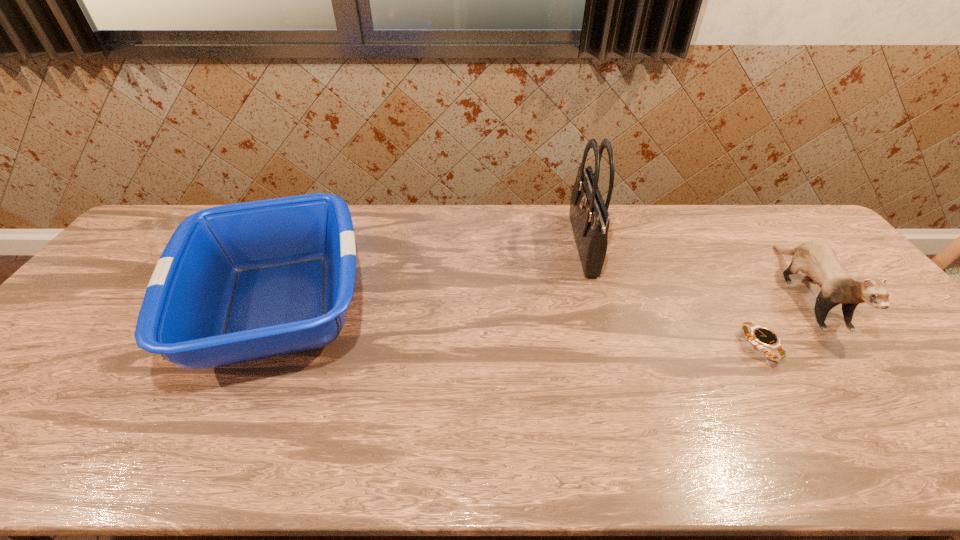
Where is `free space between the ferret and the tray`? The height and width of the screenshot is (540, 960). free space between the ferret and the tray is located at coordinates (543, 299).

You are a GUI agent. You are given a task and a screenshot of the screen. Output one action in this format:
    pyautogui.click(x=<x>, y=<y>)
    Task: Click on the free spot between the rightmost object and the handbag
    
    Given the screenshot: What is the action you would take?
    pyautogui.click(x=696, y=269)

Image resolution: width=960 pixels, height=540 pixels. Find the location of `free space that is in between the tray and the second object from left to right`. free space that is in between the tray and the second object from left to right is located at coordinates pyautogui.click(x=431, y=276).

At what (x,y) coordinates should I click in order to perform the action: click on the second closest object to the shortest object. Please return your answer as a coordinate pair (x, y). The image size is (960, 540). Looking at the image, I should click on coord(589,215).

This screenshot has width=960, height=540. I want to click on the closest object to the shortest object, so click(x=818, y=260).

You are a GUI agent. You are given a task and a screenshot of the screen. Output one action in this format:
    pyautogui.click(x=<x>, y=<y>)
    Task: Click on the free space that satisfies the following two spatial constraints: 1. with an open clasp on the front of the tallest object; 2. on the back side of the third object from left to right
    This screenshot has width=960, height=540.
    Given the screenshot: What is the action you would take?
    pyautogui.click(x=611, y=347)

The image size is (960, 540). What are the coordinates of `free space that satisfies the following two spatial constraints: 1. with an open clasp on the front of the third object from right to left; 2. on the left side of the shortest object` in the screenshot? It's located at (611, 347).

Locate an element on the screen. The image size is (960, 540). free location that satisfies the following two spatial constraints: 1. with an open clasp on the front of the tallest object; 2. on the back side of the second object from right to left is located at coordinates (611, 347).